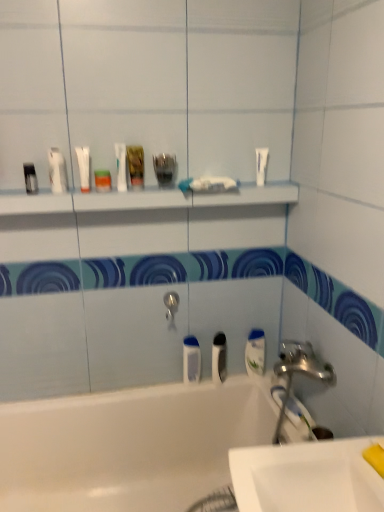
You are a GUI agent. You are given a task and a screenshot of the screen. Output one action in this format:
    pyautogui.click(x=<x>, y=<y>)
    Task: Click on the vacant area situated below white glossy shelf at upper center (from a real-world perspective)
    
    Given the screenshot: What is the action you would take?
    pyautogui.click(x=162, y=387)